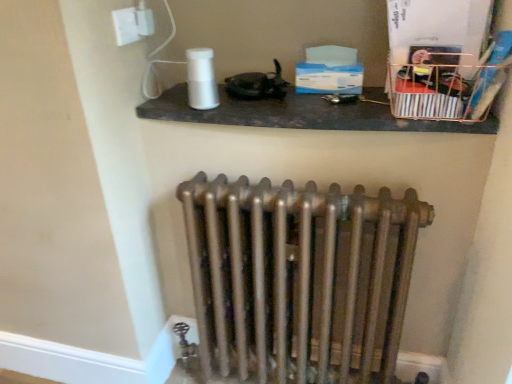
The image size is (512, 384). Find the location of `vacant area on top of metallic wire basket at upper right (from a real-world perspective)`. vacant area on top of metallic wire basket at upper right (from a real-world perspective) is located at coordinates (449, 37).